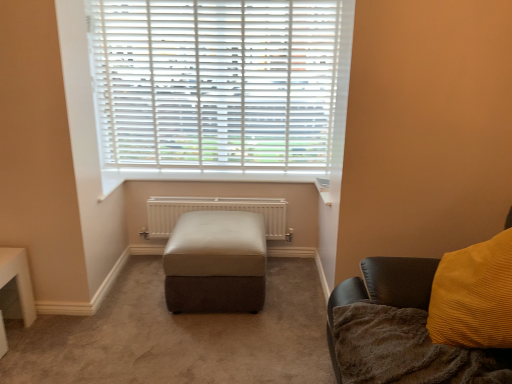
Identify the location of vacant area that is in front of leather ottoman at center. The height and width of the screenshot is (384, 512). (207, 345).